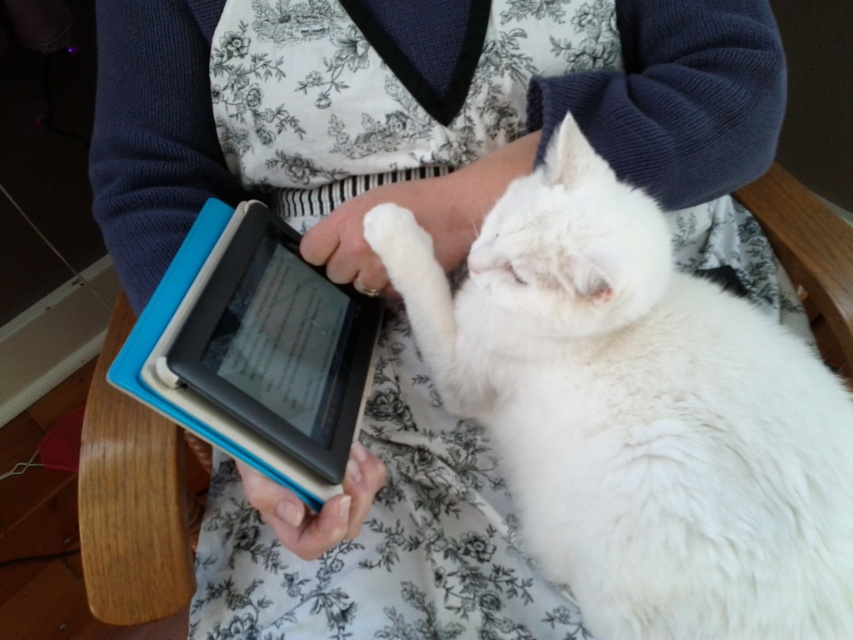
You are a delivery robot that needs to place a small package on the surface where the white fluffy cat at center and the matte blue tablet at center are located. Can you fit both the package and the tablet on the surface without disturbing the cat?

The white fluffy cat at center is bigger than the matte blue tablet at center. Since the cat is larger, there might not be enough space to place the package and the tablet without moving the cat. It is recommended to check the available space carefully before placing the package.

You are a delivery robot entering a cozy living room. You need to place a small package on the matte blue tablet at center without disturbing the white fluffy cat at center. Can you do this?

The white fluffy cat at center is positioned under the matte blue tablet at center, so placing the package on the tablet might disturb the cat as it is directly below the tablet.

You are taking a photo of the scene and want to focus on the point that is closer to the camera. Which point should you choose between point (578, 216) and point (363, 349)?

Point (578, 216) is closer to the camera than point (363, 349), so you should focus on point (578, 216).